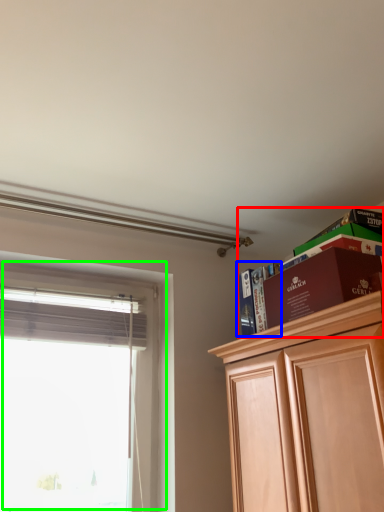
Question: Estimate the real-world distances between objects in this image. Which object is farther from shelf (highlighted by a red box), book (highlighted by a blue box) or window (highlighted by a green box)?

Choices:
 (A) book
 (B) window

Answer: (B)